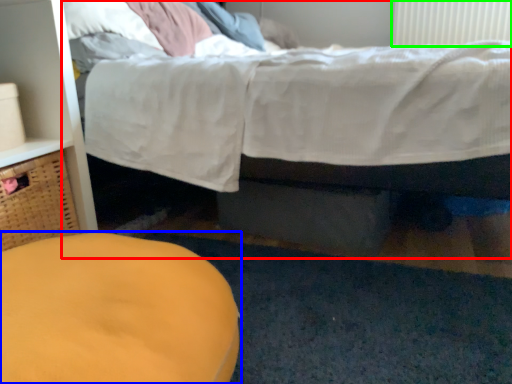
Question: Which is nearer to the bed (highlighted by a red box)? furniture (highlighted by a blue box) or radiator (highlighted by a green box).

Choices:
 (A) furniture
 (B) radiator

Answer: (A)